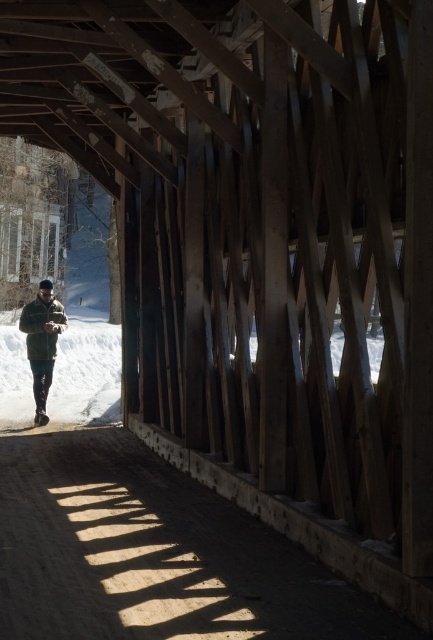
Is smooth dirt path at center to the left of camouflage jacket at center from the viewer's perspective?

In fact, smooth dirt path at center is to the right of camouflage jacket at center.

This screenshot has height=640, width=433. What are the coordinates of `smooth dirt path at center` in the screenshot? It's located at (152, 554).

Where is `smooth dirt path at center`? This screenshot has width=433, height=640. smooth dirt path at center is located at coordinates (152, 554).

Which of these two, white fluffy snow at center or camouflage jacket at center, stands taller?

Standing taller between the two is camouflage jacket at center.

Is white fluffy snow at center above camouflage jacket at center?

Yes, white fluffy snow at center is above camouflage jacket at center.

This screenshot has width=433, height=640. In order to click on white fluffy snow at center in this screenshot , I will do `click(87, 369)`.

Who is lower down, smooth dirt path at center or white fluffy snow at center?

smooth dirt path at center

Is smooth dirt path at center closer to the viewer compared to white fluffy snow at center?

Yes, it is in front of white fluffy snow at center.

Locate an element on the screen. smooth dirt path at center is located at coordinates (152, 554).

This screenshot has height=640, width=433. Find the location of `smooth dirt path at center`. smooth dirt path at center is located at coordinates (152, 554).